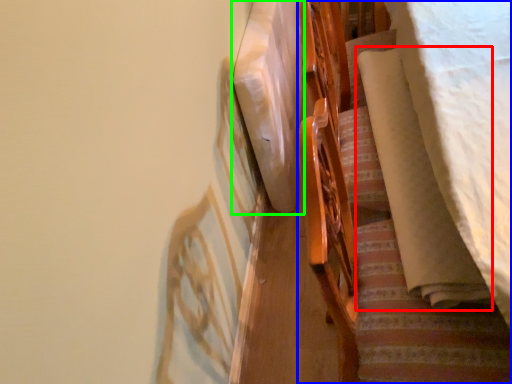
Question: Considering the real-world distances, which object is farthest from blanket (highlighted by a red box)? furniture (highlighted by a blue box) or linen (highlighted by a green box)?

Choices:
 (A) furniture
 (B) linen

Answer: (B)